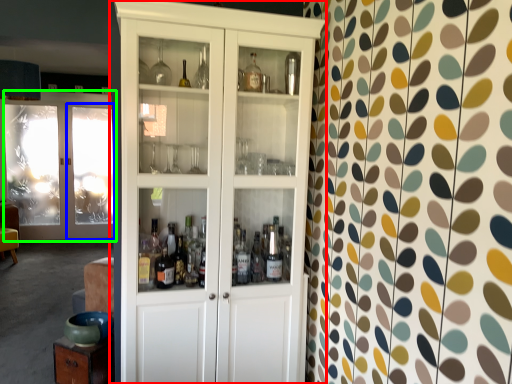
Question: Which is nearer to the cupboard (highlighted by a red box)? screen door (highlighted by a blue box) or door (highlighted by a green box).

Choices:
 (A) screen door
 (B) door

Answer: (A)